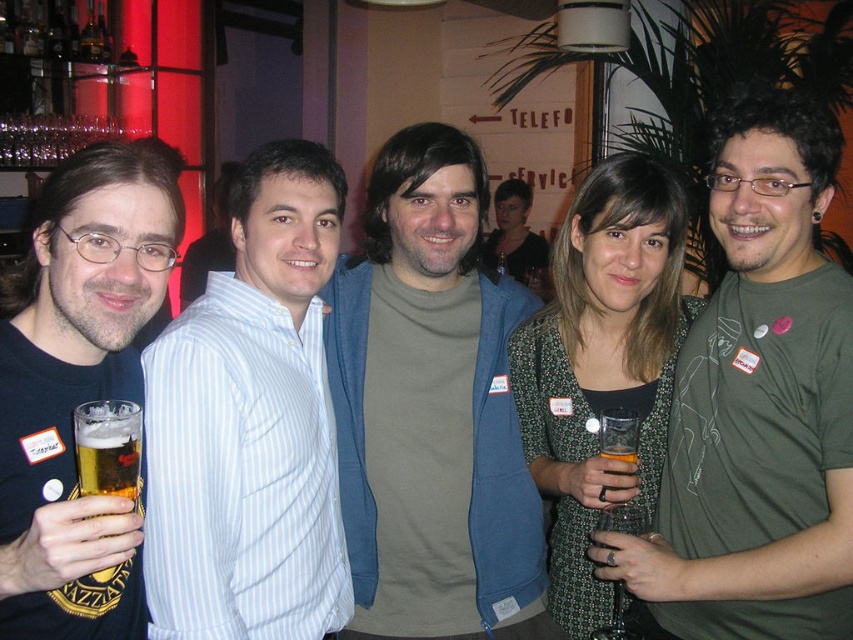
Between green matte shirt at center and white striped shirt at center, which one is positioned higher?

Positioned higher is green matte shirt at center.

Is green matte shirt at center positioned behind white striped shirt at center?

No, green matte shirt at center is in front of white striped shirt at center.

Image resolution: width=853 pixels, height=640 pixels. Find the location of `green matte shirt at center`. green matte shirt at center is located at coordinates (757, 403).

Is matte gray sweater at center above matte black t-shirt at left?

Actually, matte gray sweater at center is below matte black t-shirt at left.

Who is more distant from viewer, (347, 404) or (94, 506)?

The point (347, 404) is behind.

Locate an element on the screen. The width and height of the screenshot is (853, 640). matte gray sweater at center is located at coordinates (x=431, y=410).

Does green matte shirt at center appear on the left side of translucent glass beer at center?

Incorrect, green matte shirt at center is not on the left side of translucent glass beer at center.

Who is positioned more to the left, green matte shirt at center or translucent glass beer at center?

translucent glass beer at center

Based on the photo, who is more distant from viewer, (799, 102) or (608, 490)?

Positioned behind is point (608, 490).

Find the location of a particular element. green matte shirt at center is located at coordinates (757, 403).